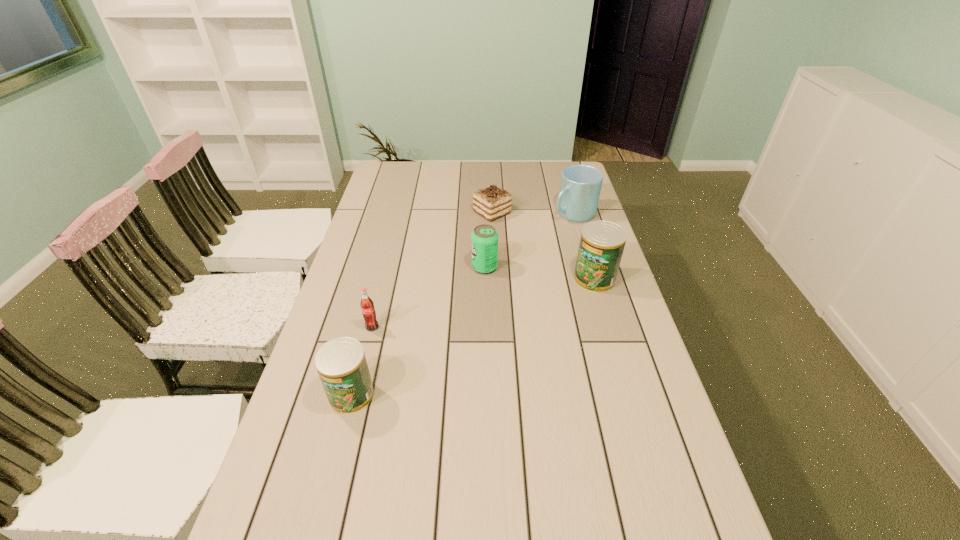
Find the location of `the nearest object`. the nearest object is located at coordinates (341, 364).

Identify the location of the shorter can. This screenshot has height=540, width=960. (341, 364).

This screenshot has width=960, height=540. Find the location of `the right can`. the right can is located at coordinates point(602,243).

You are a GUI agent. You are given a task and a screenshot of the screen. Output one action in this format:
    pyautogui.click(x=<x>, y=<y>)
    Task: Click on the taller can
    The width and height of the screenshot is (960, 540).
    Given the screenshot: What is the action you would take?
    pyautogui.click(x=602, y=243)

In order to click on the shortest object in this screenshot , I will do `click(492, 202)`.

Locate an element on the screen. This screenshot has width=960, height=540. mug is located at coordinates (580, 187).

Find the location of `the right soda bottle`. the right soda bottle is located at coordinates (484, 240).

Locate an element on the screen. This screenshot has width=960, height=540. the fifth farthest object is located at coordinates (367, 306).

I want to click on the nearer soda bottle, so click(367, 306).

Find the location of a particular element. vacant space located on the right of the nearer can is located at coordinates (503, 394).